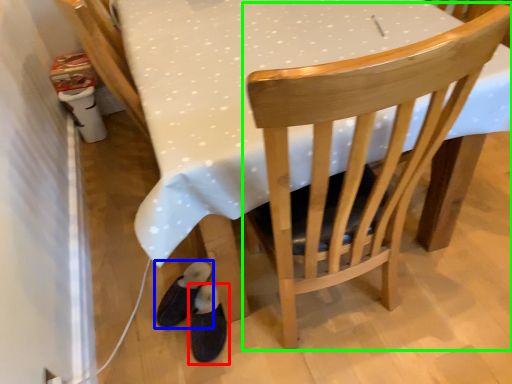
Question: Estimate the real-world distances between objects in this image. Which object is closer to footwear (highlighted by a red box), footwear (highlighted by a blue box) or chair (highlighted by a green box)?

Choices:
 (A) footwear
 (B) chair

Answer: (A)